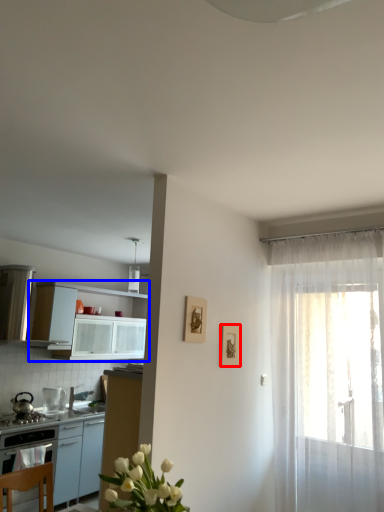
Question: Which object is closer to the camera taking this photo, picture frame (highlighted by a red box) or cabinetry (highlighted by a blue box)?

Choices:
 (A) picture frame
 (B) cabinetry

Answer: (A)